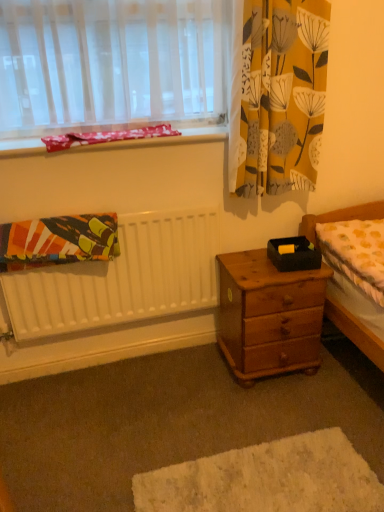
I want to click on vacant space situated above wooden drawer at lower right (from a real-world perspective), so [197, 431].